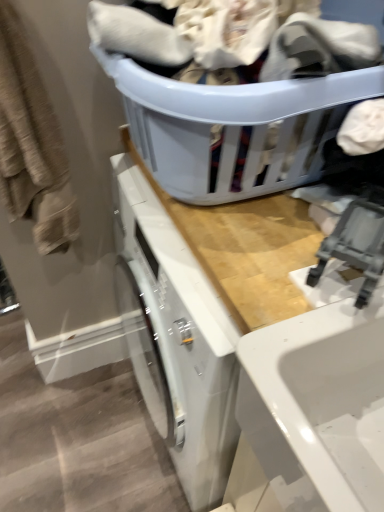
Question: Is wooden counter at upper center a part of beige textured towel at left?

Choices:
 (A) yes
 (B) no

Answer: (B)

Question: Is beige textured towel at left smaller than wooden counter at upper center?

Choices:
 (A) yes
 (B) no

Answer: (A)

Question: From the image's perspective, would you say beige textured towel at left is positioned over wooden counter at upper center?

Choices:
 (A) no
 (B) yes

Answer: (B)

Question: From a real-world perspective, is beige textured towel at left over wooden counter at upper center?

Choices:
 (A) no
 (B) yes

Answer: (B)

Question: Does beige textured towel at left appear on the left side of wooden counter at upper center?

Choices:
 (A) no
 (B) yes

Answer: (B)

Question: From the image's perspective, is matte plastic laundry basket at upper center above or below wooden counter at upper center?

Choices:
 (A) below
 (B) above

Answer: (B)

Question: Considering the positions of matte plastic laundry basket at upper center and wooden counter at upper center in the image, is matte plastic laundry basket at upper center wider or thinner than wooden counter at upper center?

Choices:
 (A) thin
 (B) wide

Answer: (A)

Question: Would you say matte plastic laundry basket at upper center is to the left or to the right of wooden counter at upper center in the picture?

Choices:
 (A) left
 (B) right

Answer: (A)

Question: From a real-world perspective, is matte plastic laundry basket at upper center physically located above or below wooden counter at upper center?

Choices:
 (A) below
 (B) above

Answer: (B)

Question: Is point tap(218, 150) positioned closer to the camera than point tap(57, 233)?

Choices:
 (A) closer
 (B) farther

Answer: (A)

Question: In terms of width, does matte plastic laundry basket at upper center look wider or thinner when compared to beige textured towel at left?

Choices:
 (A) thin
 (B) wide

Answer: (B)

Question: From a real-world perspective, is matte plastic laundry basket at upper center above or below beige textured towel at left?

Choices:
 (A) below
 (B) above

Answer: (B)

Question: Is matte plastic laundry basket at upper center inside or outside of beige textured towel at left?

Choices:
 (A) outside
 (B) inside

Answer: (A)

Question: Relative to wooden counter at upper center, is beige textured towel at left in front or behind?

Choices:
 (A) behind
 (B) front

Answer: (A)

Question: Considering the positions of beige textured towel at left and wooden counter at upper center in the image, is beige textured towel at left taller or shorter than wooden counter at upper center?

Choices:
 (A) tall
 (B) short

Answer: (B)